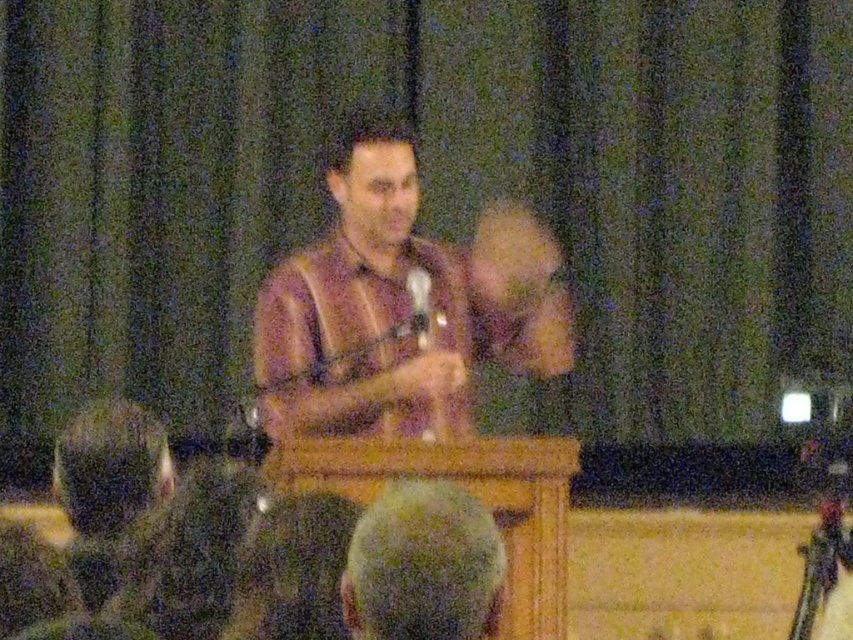
Which of these two, matte brown shirt at center or smooth brown hair at center, stands shorter?

smooth brown hair at center

Does matte brown shirt at center appear on the right side of smooth brown hair at center?

No, matte brown shirt at center is not to the right of smooth brown hair at center.

Is point (399, 134) behind point (448, 513)?

Yes, it is.

Where is `matte brown shirt at center`? The width and height of the screenshot is (853, 640). matte brown shirt at center is located at coordinates (399, 301).

Is smooth brown hair at center wider than dark green fabric at lower center?

Yes.

Is point (397, 515) positioned after point (308, 522)?

No, (397, 515) is closer to viewer.

Image resolution: width=853 pixels, height=640 pixels. Identify the location of smooth brown hair at center. (422, 564).

Where is `matte brown shirt at center`? This screenshot has width=853, height=640. matte brown shirt at center is located at coordinates (399, 301).

The height and width of the screenshot is (640, 853). Identify the location of matte brown shirt at center. click(399, 301).